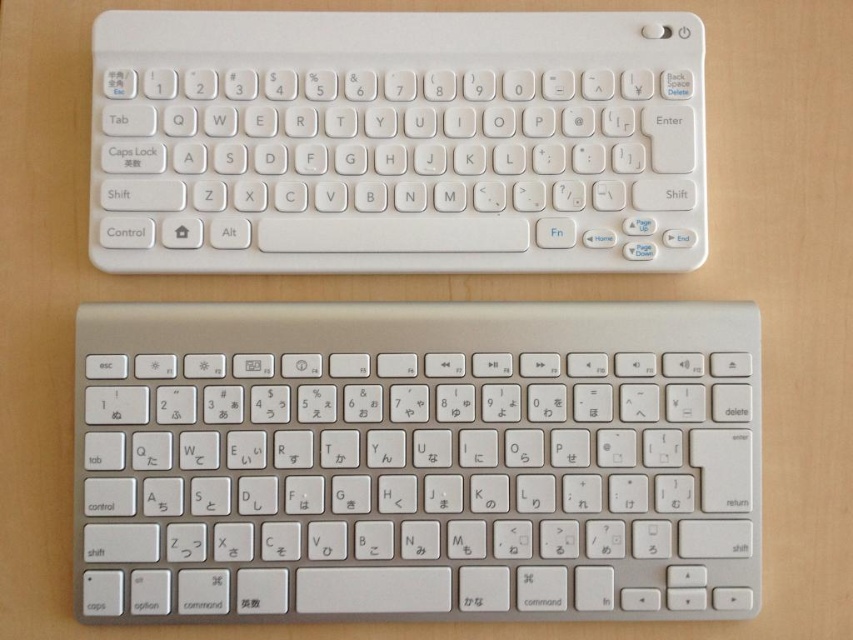
Does satin silver keyboard at center have a lesser height compared to white plastic keyboard at upper center?

Incorrect, satin silver keyboard at center's height does not fall short of white plastic keyboard at upper center's.

Who is shorter, satin silver keyboard at center or white plastic keyboard at upper center?

With less height is white plastic keyboard at upper center.

I want to click on satin silver keyboard at center, so click(x=416, y=461).